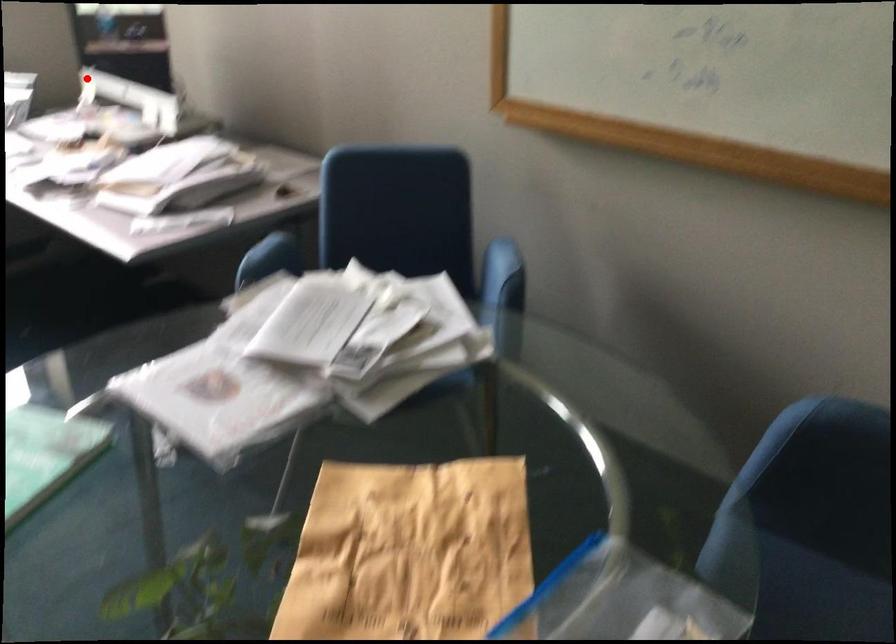
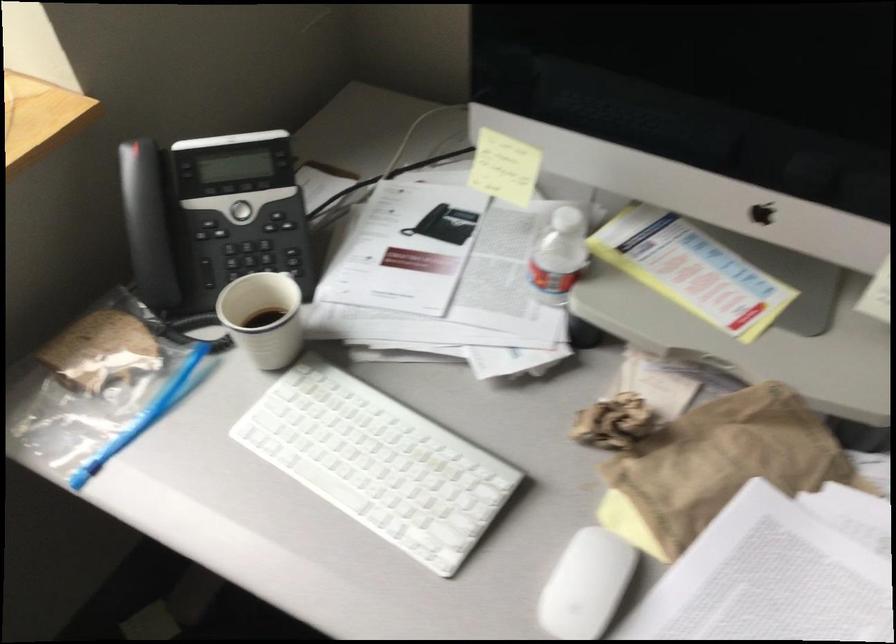
Where in the second image is the point corresponding to the highlighted location from the first image?

(558, 254)